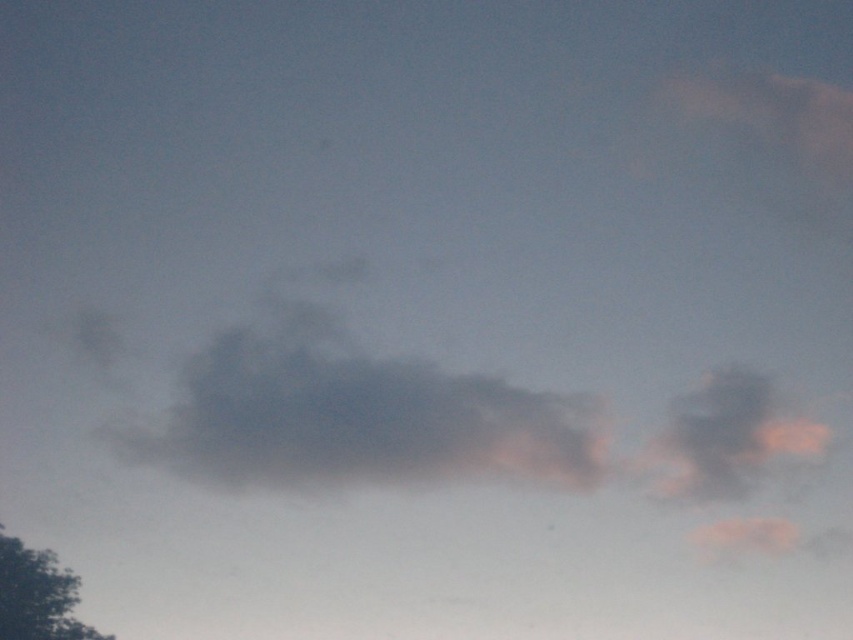
Question: Among these points, which one is nearest to the camera?

Choices:
 (A) 491,419
 (B) 30,625

Answer: (A)

Question: Does dark gray fluffy cloud at center have a lesser width compared to green leafy tree at lower left?

Choices:
 (A) yes
 (B) no

Answer: (B)

Question: Does dark gray fluffy cloud at center come in front of green leafy tree at lower left?

Choices:
 (A) yes
 (B) no

Answer: (A)

Question: Which object appears closest to the camera in this image?

Choices:
 (A) green leafy tree at lower left
 (B) dark gray fluffy cloud at center

Answer: (B)

Question: Can you confirm if dark gray fluffy cloud at center is smaller than green leafy tree at lower left?

Choices:
 (A) yes
 (B) no

Answer: (B)